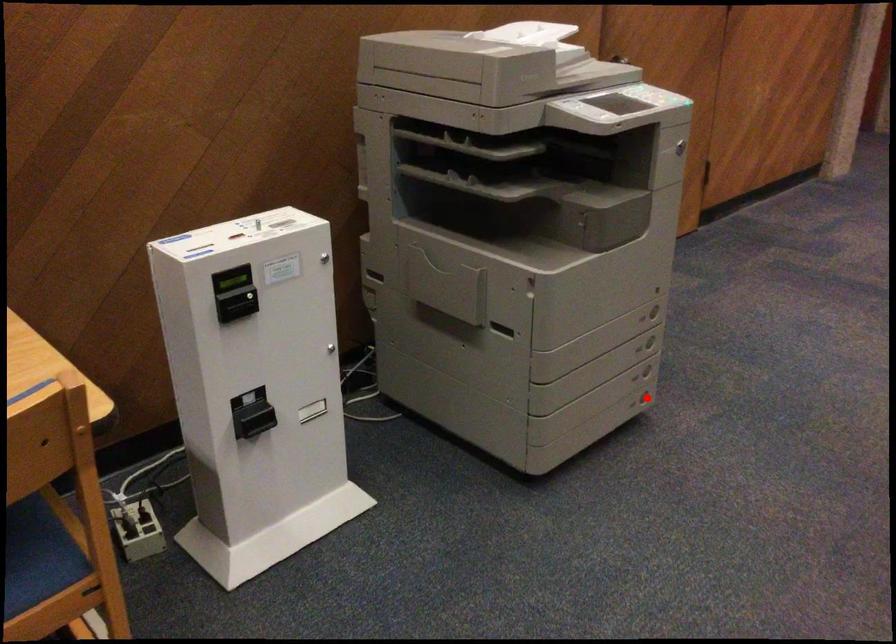
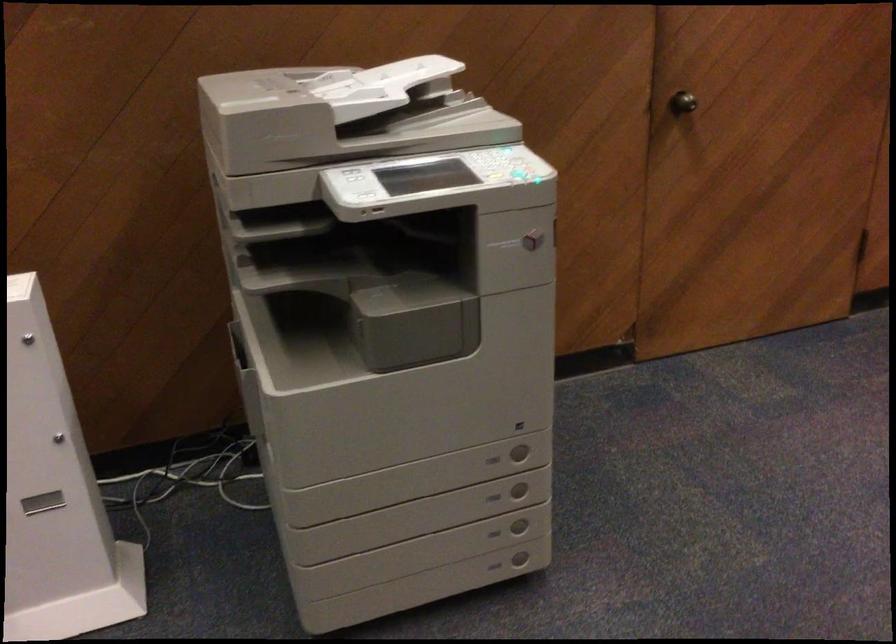
Where in the second image is the point corresponding to the highlighted location from the first image?

(520, 559)